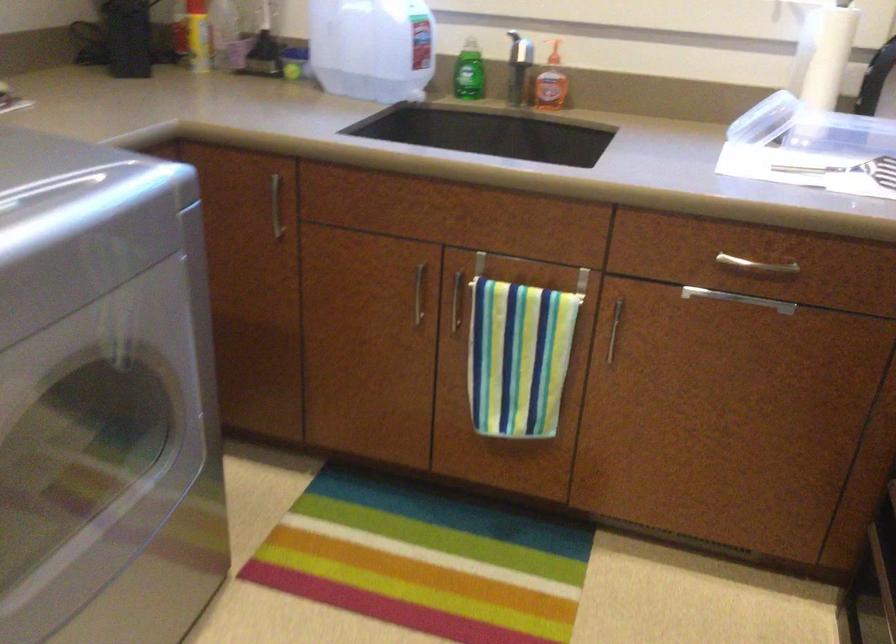
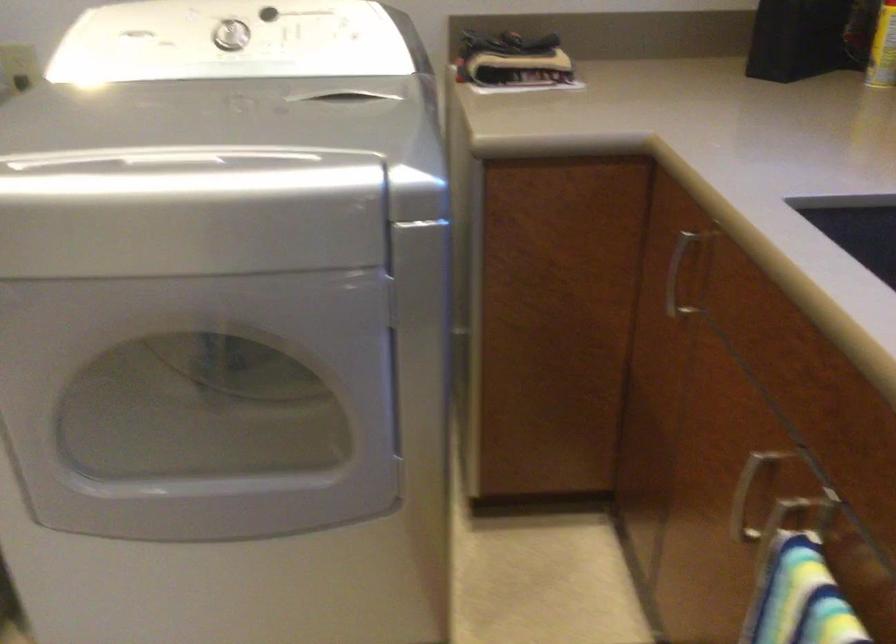
In the second image, find the point that corresponds to pixel 402 304 in the first image.

(745, 497)